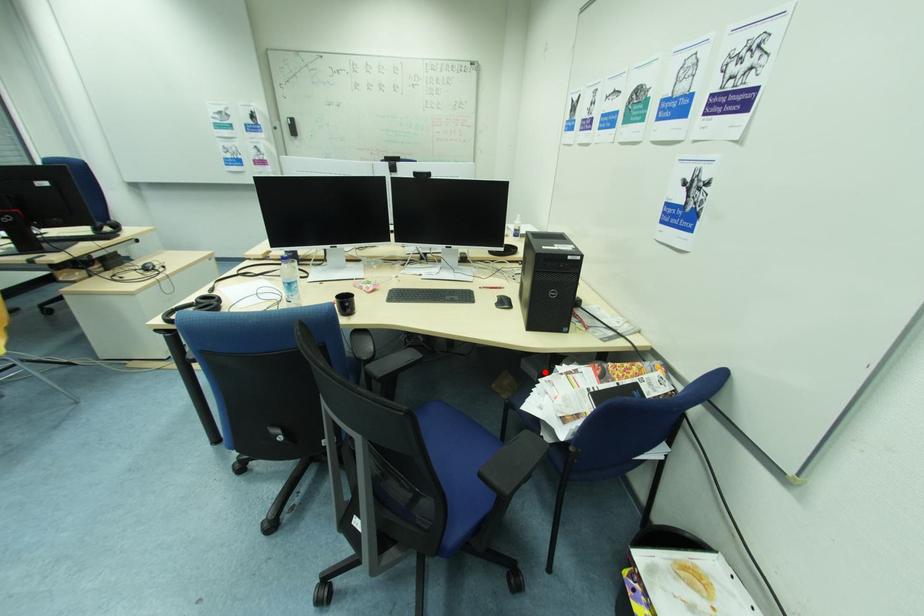
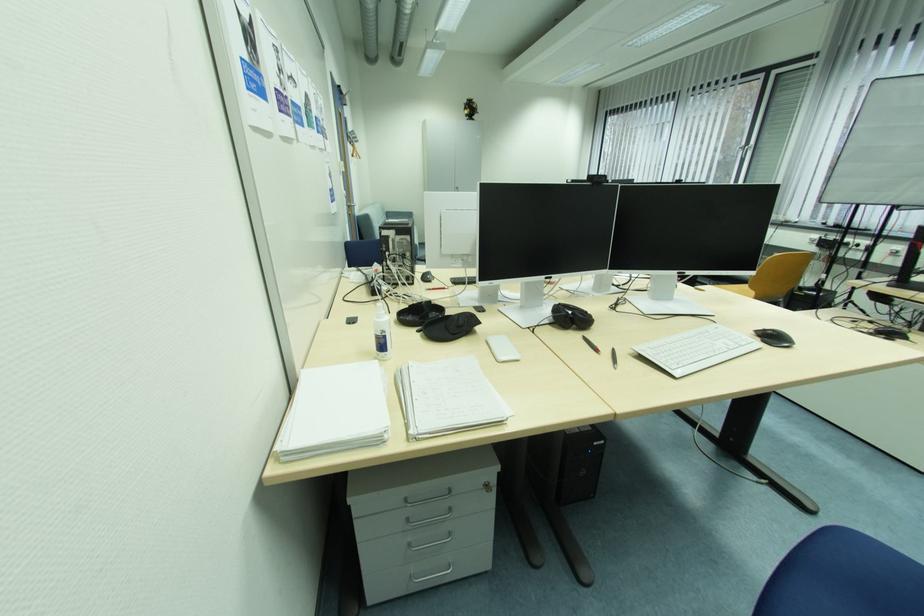
Question: I am providing you with two images of the same scene from different viewpoints. A red point is marked on the first image. At the location where the point appears in image 1, is it still visible in image 2?

Choices:
 (A) Yes
 (B) No

Answer: (B)